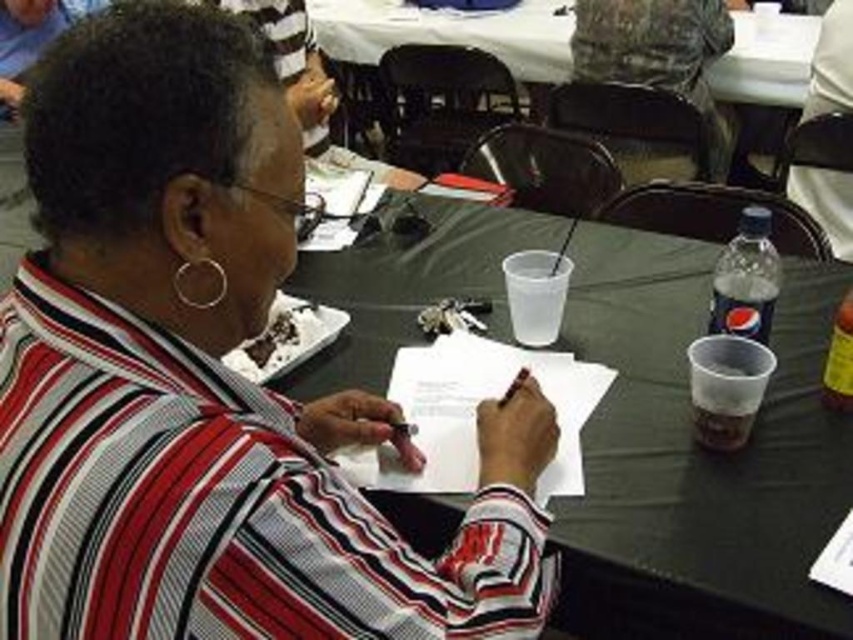
Which of these two, striped fabric shirt at center or black plastic table at center, stands taller?

black plastic table at center is taller.

Between point (120, 531) and point (698, 512), which one is positioned behind?

Positioned behind is point (698, 512).

This screenshot has width=853, height=640. In order to click on striped fabric shirt at center in this screenshot , I will do `click(207, 380)`.